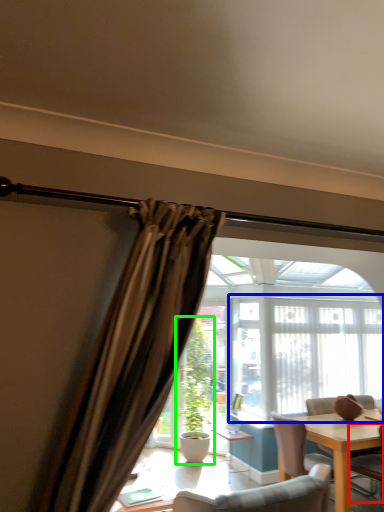
Question: Which is nearer to the chair (highlighted by a red box)? window frame (highlighted by a blue box) or houseplant (highlighted by a green box).

Choices:
 (A) window frame
 (B) houseplant

Answer: (A)